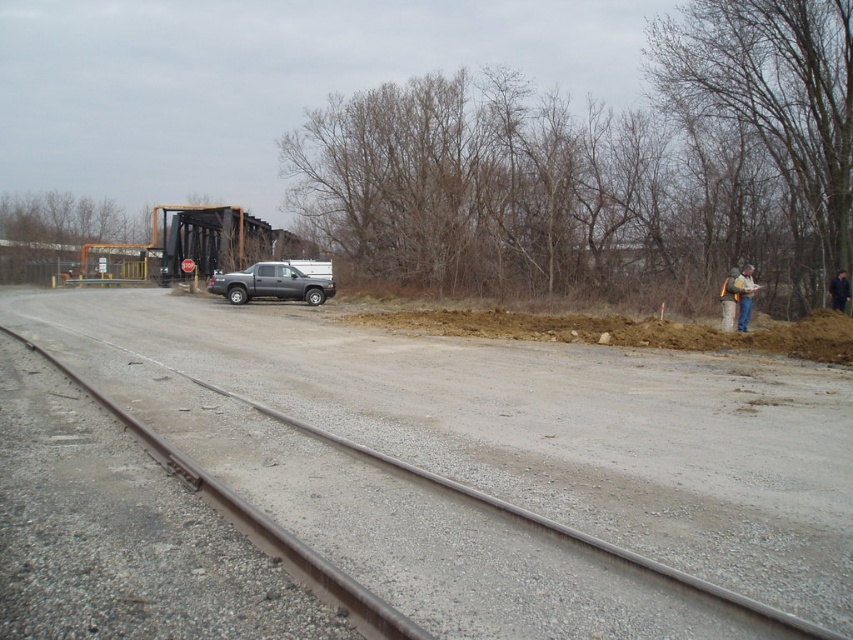
You are standing at the origin point of the image. Looking at the rusty metal track at center, can you tell me its coordinates in the image?

The coordinates of the rusty metal track at center are at point (492, 502).

You are a pedestrian standing at the edge of the dirt road and see the gray metallic truck at center and the blue jeans at right. Which object is closer to you?

The gray metallic truck at center is positioned over blue jeans at right, so it is closer to you.

You are standing at the point marked by the coordinate point at (271, 284) in the image. What object are you standing on?

The point at (271, 284) marks the gray metallic truck at center, so you are standing on the gray metallic truck at center.